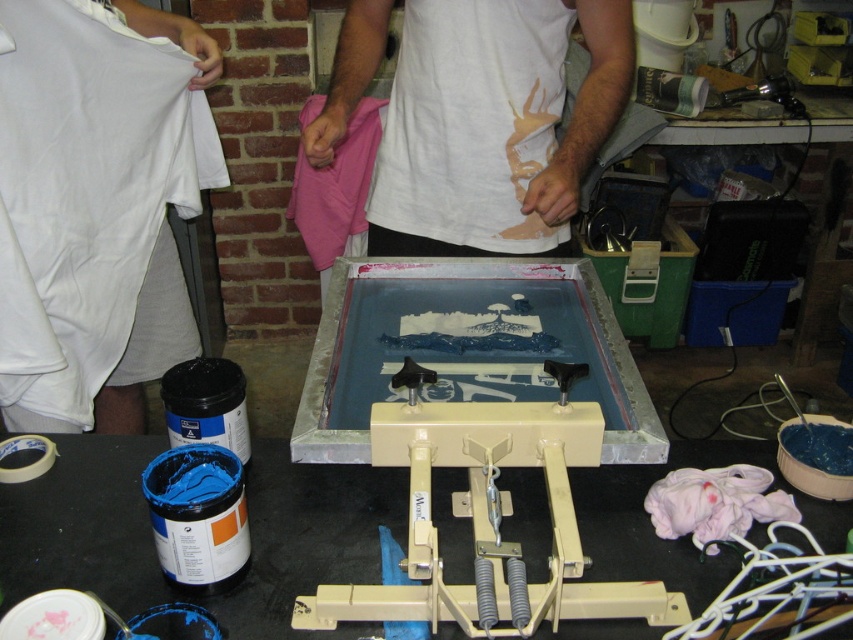
You are standing in front of the screen printing setup and want to reach both the point at coordinates point [190,22] and point [538,484]. Which point will you reach first?

You will reach the point at coordinates point [190,22] first because it is closer to you than point [538,484], which is further away.

Looking at this image, you are standing in front of the screen printing setup and want to place the white cotton shirt at center onto the black plastic table at center. Can you easily reach the shirt from your current position?

The black plastic table at center is closer to the viewer than the white cotton shirt at center, so you can easily reach the shirt from your current position by moving it towards the table.